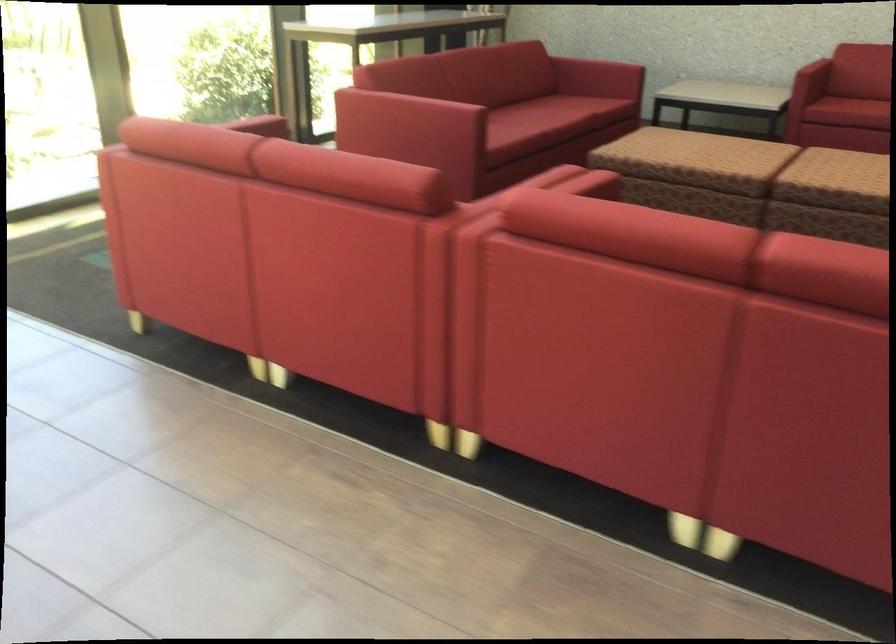
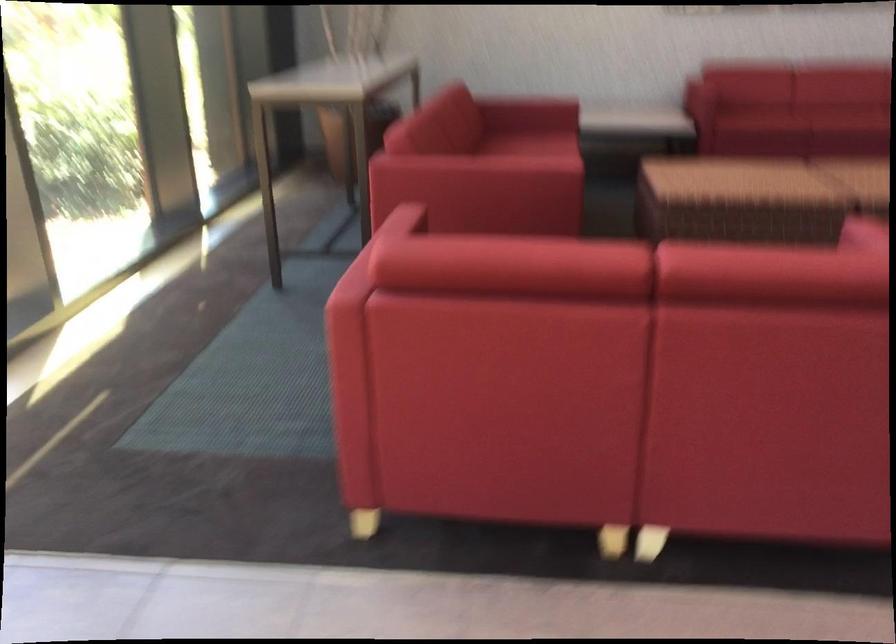
Question: Which direction would the cameraman need to move to produce the second image? Reply with the corresponding letter.

Choices:
 (A) Left
 (B) Right
 (C) Forward
 (D) Backward

Answer: (D)